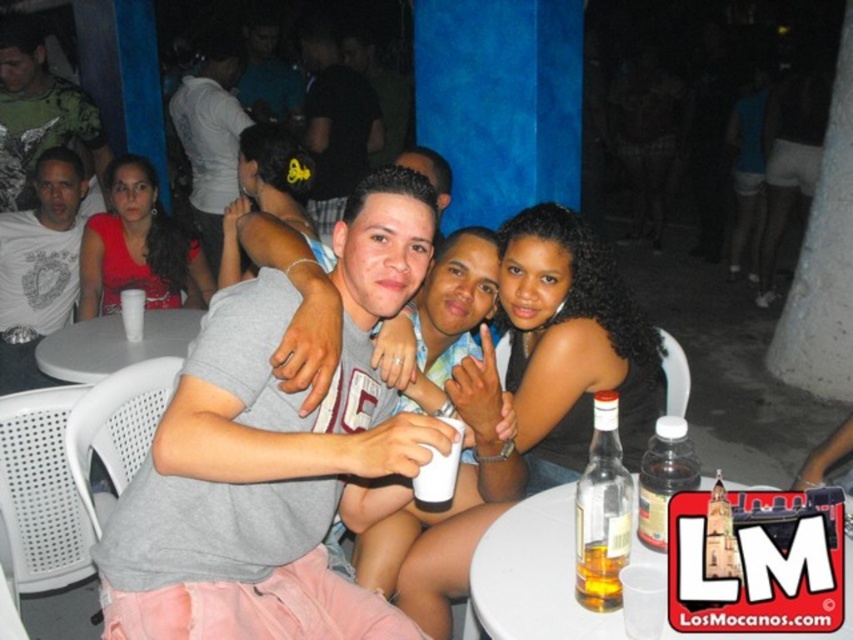
Based on the scene description, where is the gray cotton shirt at center located in terms of coordinates?

The gray cotton shirt at center is located at point [271,456].